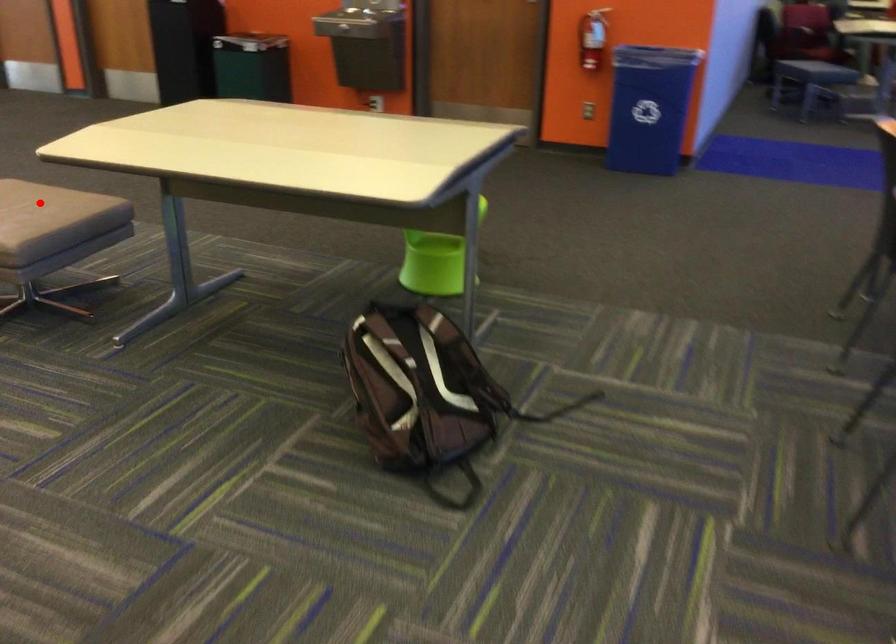
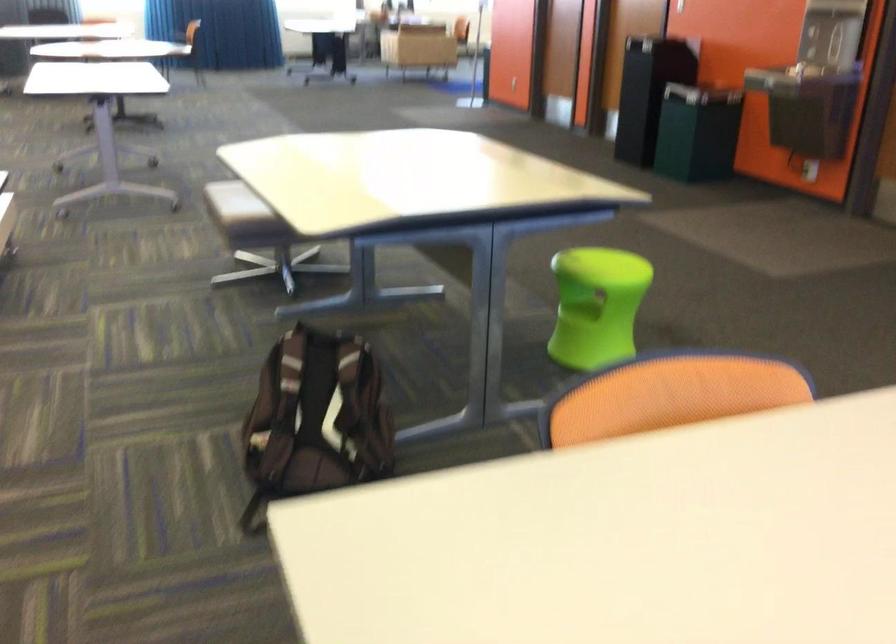
Question: I am providing you with two images of the same scene from different viewpoints. A red point is marked on the first image. At the location where the point appears in image 1, is it still visible in image 2?

Choices:
 (A) Yes
 (B) No

Answer: (B)